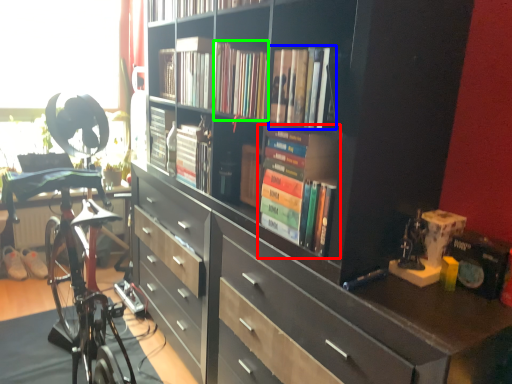
Question: Which is nearer to the book (highlighted by a red box)? book (highlighted by a blue box) or book (highlighted by a green box).

Choices:
 (A) book
 (B) book

Answer: (A)